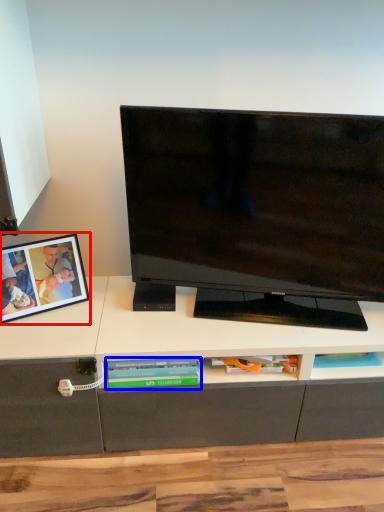
Question: Which object appears closest to the camera in this image, picture frame (highlighted by a red box) or book (highlighted by a blue box)?

Choices:
 (A) picture frame
 (B) book

Answer: (A)